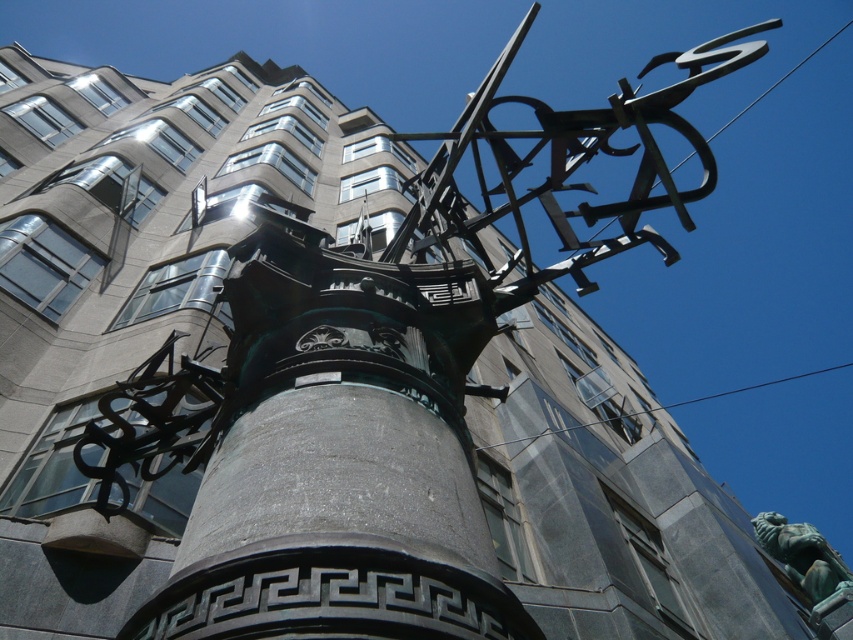
You are an architect examining the building. You notice the green patina stone pillar at center and the green patina statue at lower right. Which one is located higher in the image?

The green patina stone pillar at center is positioned over the green patina statue at lower right, so it is higher up in the image.